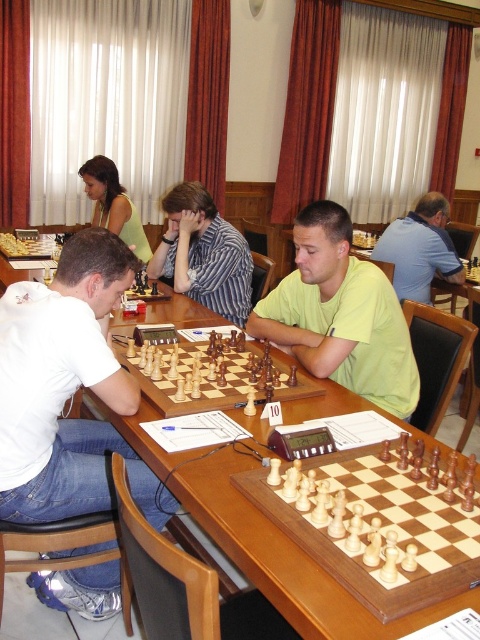
In the scene shown: You are a photographer standing at the back of the room. You want to take a photo of the wooden chessboard at center and the striped shirt at center without any obstruction. Based on their positions, can you see both objects clearly in your frame?

The wooden chessboard at center is below striped shirt at center, so the striped shirt at center may block the view of the wooden chessboard at center. Therefore, you might not be able to see both objects clearly in your frame without adjusting your angle or moving the objects.

In the chess tournament scene, you see a striped shirt at center and a matte green shirt at upper left. Which of these two shirts is positioned to the right of the other?

The striped shirt at center is positioned to the right of the matte green shirt at upper left.